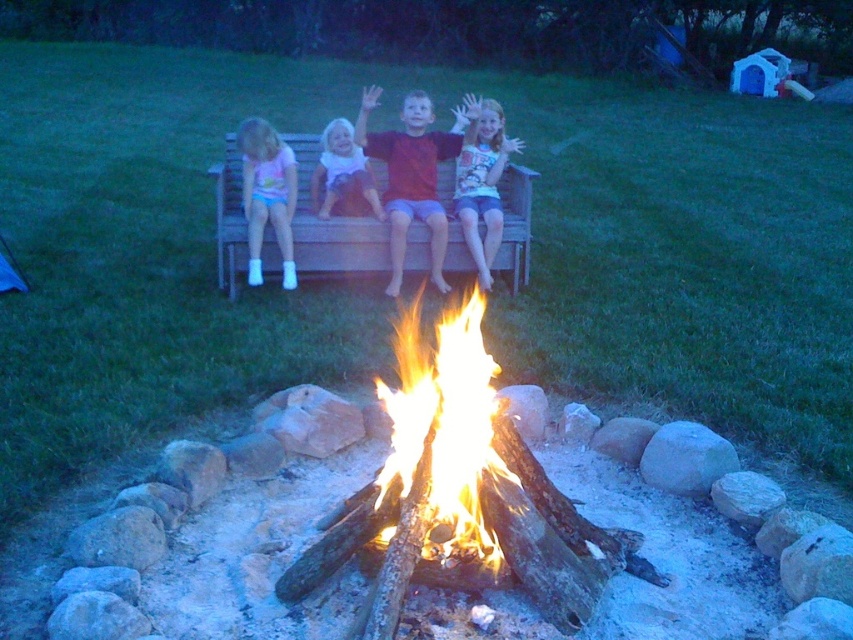
Looking at this image, you are a photographer trying to capture the scene of the campfire. You notice the matte red shirt at center and the matte pink shorts at left. Which clothing item is positioned higher in the image?

The matte red shirt at center is located above the matte pink shorts at left, so the matte red shirt at center is positioned higher in the image.

You are a photographer standing in front of the fire pit and want to capture both the matte red shirt at center and the matte pink shirt at center in the same frame. Which shirt should you focus on first to ensure both are in focus?

The matte red shirt at center is positioned over the matte pink shirt at center, so focusing on the matte red shirt at center first will ensure both are in focus as the matte pink shirt is behind it.

You are standing in the dusk scene with the campfire. You see two shirts at the center area, a matte pink shirt at center and a white cotton shirt at center. Which shirt is positioned lower in the image?

The matte pink shirt at center is located below the white cotton shirt at center, so the matte pink shirt at center is positioned lower in the image.